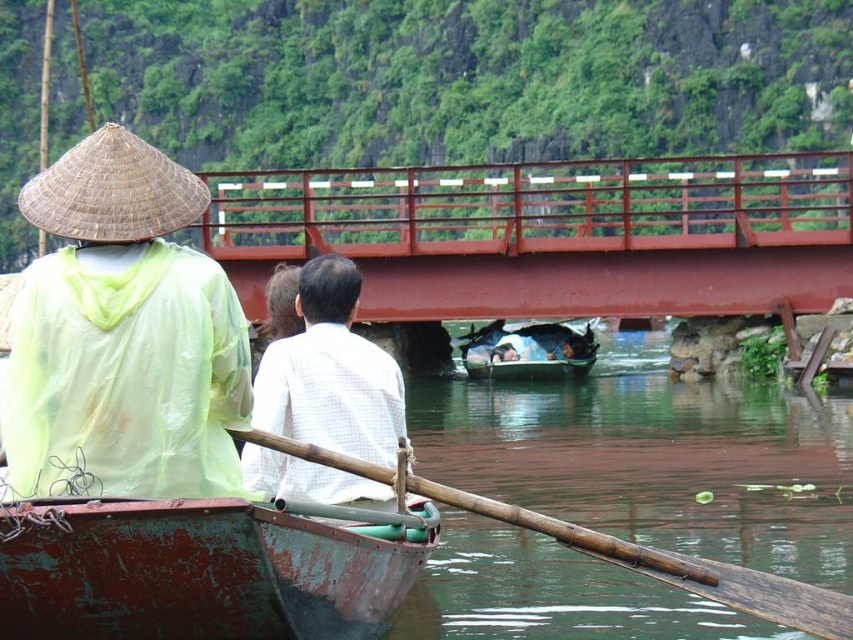
You are standing on the riverbank and see a small boat with two people. The boat is at point (735, 168). If you want to throw a lifebuoy to them, will it reach them? Assume you can throw 250 feet.

The distance between you and the boat at point (735, 168) is 260.77 feet. Since your throwing range is 250 feet, you cannot reach them. You need a longer distance or a different method to reach them.

You are a tourist in a tropical region and want to take a photo of the wooden boat at center with the brown bamboo paddle at lower center. To ensure both are in the frame, should you position yourself to the left or right side of the boat?

The brown bamboo paddle at lower center is positioned on the left side of wooden boat at center, so to include both in the photo, you should position yourself to the right side of the boat.

You are navigating a small boat on a river and see the red metal bridge at center. If you want to reach the bridge, in which direction should you steer your boat?

The red metal bridge at center is located at point coordinates 0.367 on the x axis and 0.649 on the y axis. Since the boat is in the foreground, you should steer your boat forward towards the center of the image to reach the bridge.